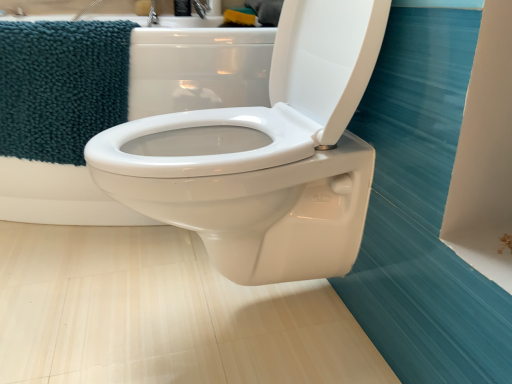
Question: Does teal plush towel at upper left appear on the right side of white glossy toilet at center?

Choices:
 (A) no
 (B) yes

Answer: (A)

Question: Is teal plush towel at upper left turned away from white glossy toilet at center?

Choices:
 (A) yes
 (B) no

Answer: (A)

Question: Considering the relative positions of teal plush towel at upper left and white glossy toilet at center in the image provided, is teal plush towel at upper left behind white glossy toilet at center?

Choices:
 (A) yes
 (B) no

Answer: (A)

Question: Does teal plush towel at upper left have a larger size compared to white glossy toilet at center?

Choices:
 (A) no
 (B) yes

Answer: (A)

Question: Could you tell me if teal plush towel at upper left is facing white glossy toilet at center?

Choices:
 (A) yes
 (B) no

Answer: (A)

Question: Is teal plush towel at upper left wider than white glossy toilet at center?

Choices:
 (A) no
 (B) yes

Answer: (A)

Question: Can you confirm if white glossy toilet at center is wider than teal plush towel at upper left?

Choices:
 (A) no
 (B) yes

Answer: (B)

Question: Is teal plush towel at upper left at the back of white glossy toilet at center?

Choices:
 (A) yes
 (B) no

Answer: (B)

Question: Can you see white glossy toilet at center touching teal plush towel at upper left?

Choices:
 (A) yes
 (B) no

Answer: (B)

Question: Does white glossy toilet at center have a smaller size compared to teal plush towel at upper left?

Choices:
 (A) yes
 (B) no

Answer: (B)

Question: From the image's perspective, would you say white glossy toilet at center is shown under teal plush towel at upper left?

Choices:
 (A) yes
 (B) no

Answer: (B)

Question: Considering the relative positions of white glossy toilet at center and teal plush towel at upper left in the image provided, is white glossy toilet at center to the right of teal plush towel at upper left from the viewer's perspective?

Choices:
 (A) no
 (B) yes

Answer: (B)

Question: From the image's perspective, relative to white glossy toilet at center, is teal plush towel at upper left above or below?

Choices:
 (A) below
 (B) above

Answer: (A)